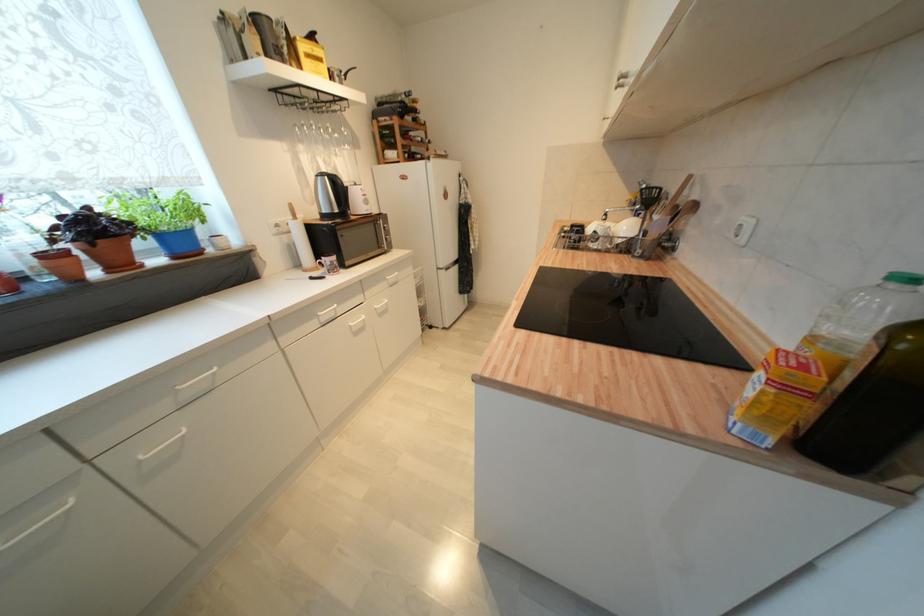
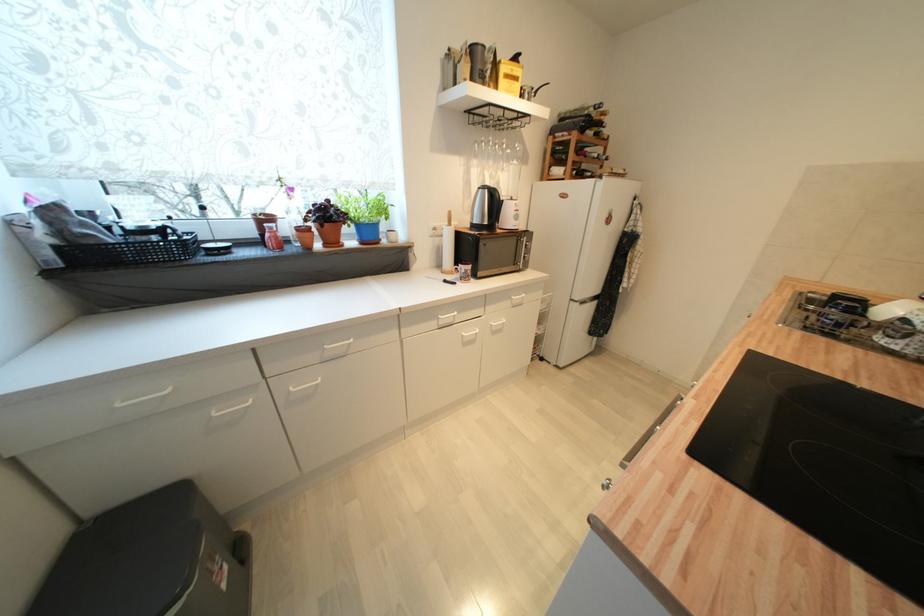
Where in the second image is the point corresponding to [351,240] from the first image?

(492, 251)